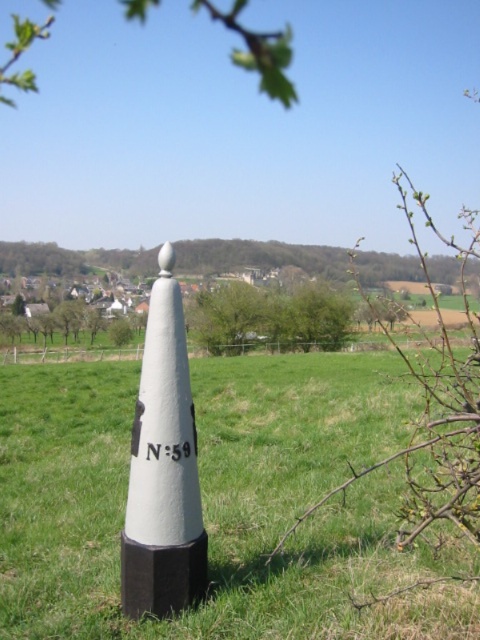
You are a landscape architect designing a garden layout. You have two elements to place in the garden plot. The first is the white painted concrete cone at center, and the second is the green leafy branch at upper center. Given their sizes, which element would you choose to place in a corner where space is limited?

The white painted concrete cone at center occupies less space than the green leafy branch at upper center, so it would be more suitable for placement in a corner with limited space.